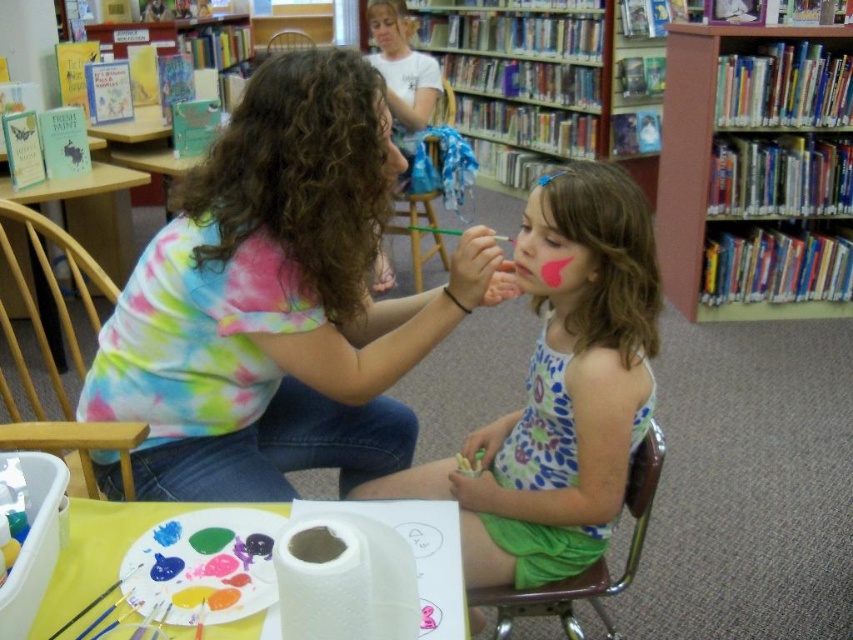
Question: Among these points, which one is farthest from the camera?

Choices:
 (A) (428, 141)
 (B) (299, 45)

Answer: (B)

Question: Considering the relative positions of matte pink paint at center and white paper towel at lower center in the image provided, where is matte pink paint at center located with respect to white paper towel at lower center?

Choices:
 (A) left
 (B) right

Answer: (B)

Question: Which point is farther to the camera?

Choices:
 (A) wooden bookshelf at upper right
 (B) green fabric chair at lower right

Answer: (A)

Question: Does wooden bookshelf at upper right have a smaller size compared to green fabric chair at lower right?

Choices:
 (A) no
 (B) yes

Answer: (A)

Question: Which object is positioned closest to the smooth skin face at upper center?

Choices:
 (A) pink matte paint at center
 (B) tie-dye shirt at center
 (C) wooden chair at left

Answer: (C)

Question: Is white paper towel at lower center to the left of smooth skin face at upper center from the viewer's perspective?

Choices:
 (A) no
 (B) yes

Answer: (A)